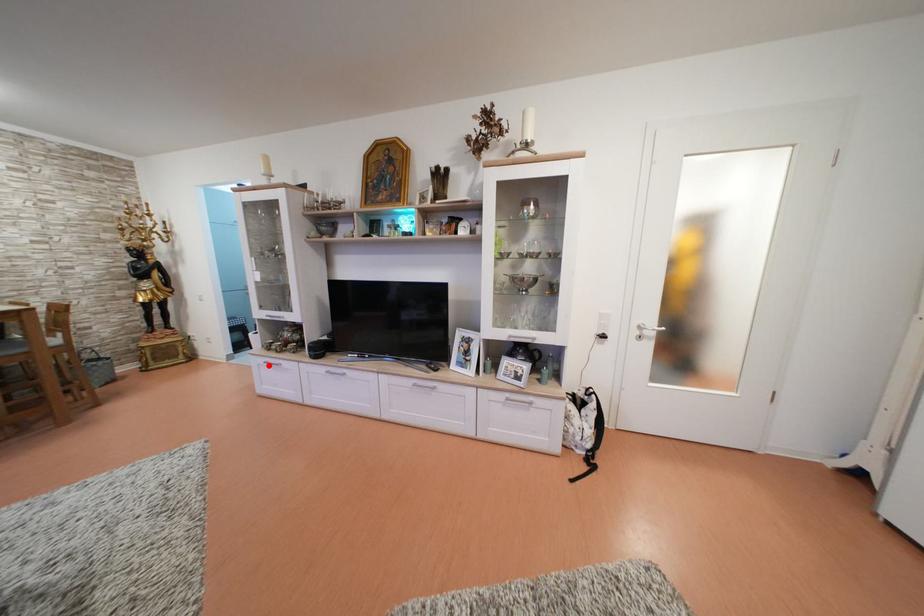
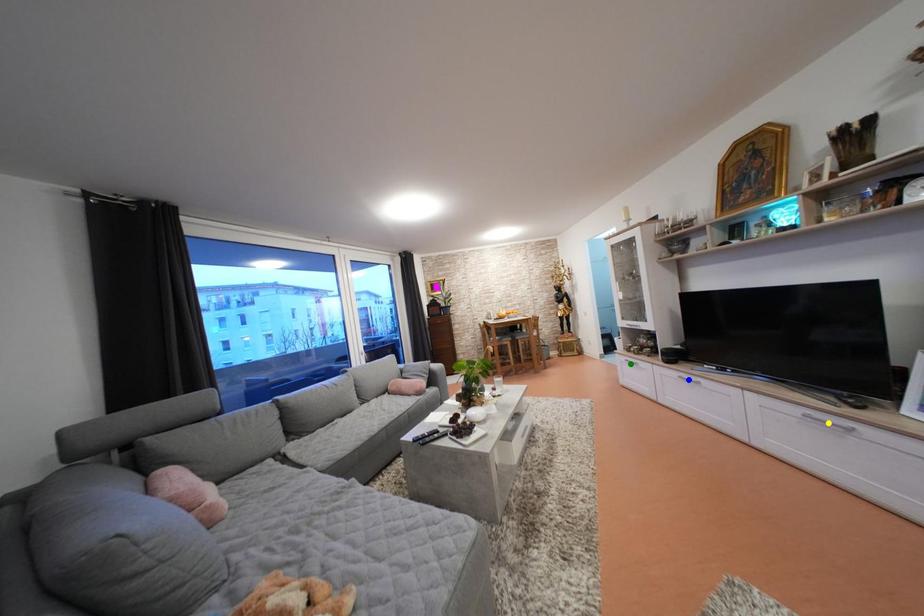
Question: I am providing you with two images of the same scene from different viewpoints. A red point is marked on the first image. You are given multiple points on the second image. Can you choose the point in image 2 that corresponds to the point in image 1?

Choices:
 (A) green point
 (B) blue point
 (C) yellow point

Answer: (A)